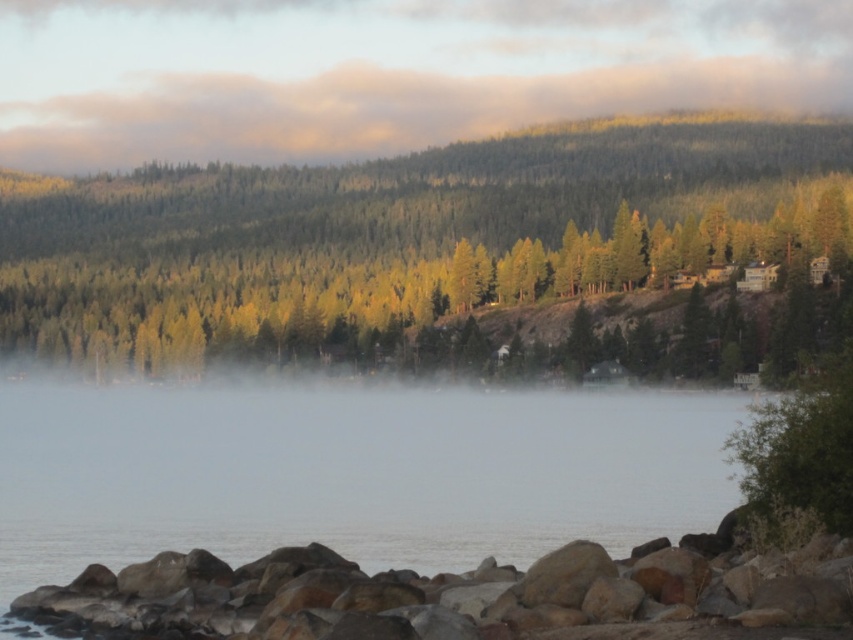
Question: Which point is closer to the camera?

Choices:
 (A) (703, 582)
 (B) (572, 96)

Answer: (A)

Question: Does green textured trees at center appear over rustic stone rocks at lower left?

Choices:
 (A) yes
 (B) no

Answer: (A)

Question: Can you confirm if green textured trees at center is bigger than foggy mist at upper center?

Choices:
 (A) no
 (B) yes

Answer: (A)

Question: Which object is closer to the camera taking this photo?

Choices:
 (A) green textured trees at center
 (B) rustic stone rocks at lower left
 (C) foggy mist at upper center

Answer: (B)

Question: Among these objects, which one is farthest from the camera?

Choices:
 (A) green textured trees at center
 (B) foggy mist at upper center

Answer: (B)

Question: Considering the relative positions of foggy mist at upper center and rustic stone rocks at lower left in the image provided, where is foggy mist at upper center located with respect to rustic stone rocks at lower left?

Choices:
 (A) below
 (B) above

Answer: (B)